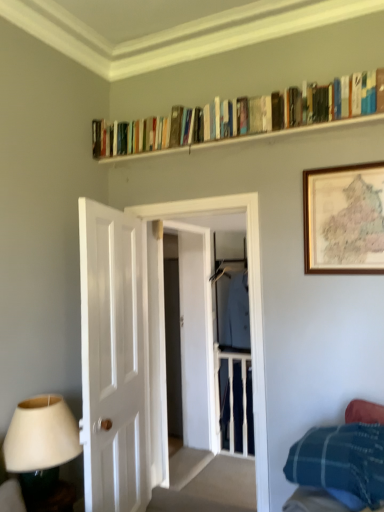
Question: In terms of width, does matte white lampshade at lower left look wider or thinner when compared to white glossy door at left?

Choices:
 (A) wide
 (B) thin

Answer: (A)

Question: Would you say matte white lampshade at lower left is to the left or to the right of white glossy door at left in the picture?

Choices:
 (A) right
 (B) left

Answer: (B)

Question: Considering the real-world distances, which object is closest to the wooden bookshelf at upper center?

Choices:
 (A) white glossy door at left
 (B) hardcover books at upper center
 (C) blue plaid blanket at lower right
 (D) transparent glass door at center
 (E) matte white lampshade at lower left

Answer: (B)

Question: Estimate the real-world distances between objects in this image. Which object is farther from the matte white lampshade at lower left?

Choices:
 (A) transparent glass door at center
 (B) white glossy door at left
 (C) blue plaid blanket at lower right
 (D) wooden framed map at upper right
 (E) light blue fabric coat at center

Answer: (E)